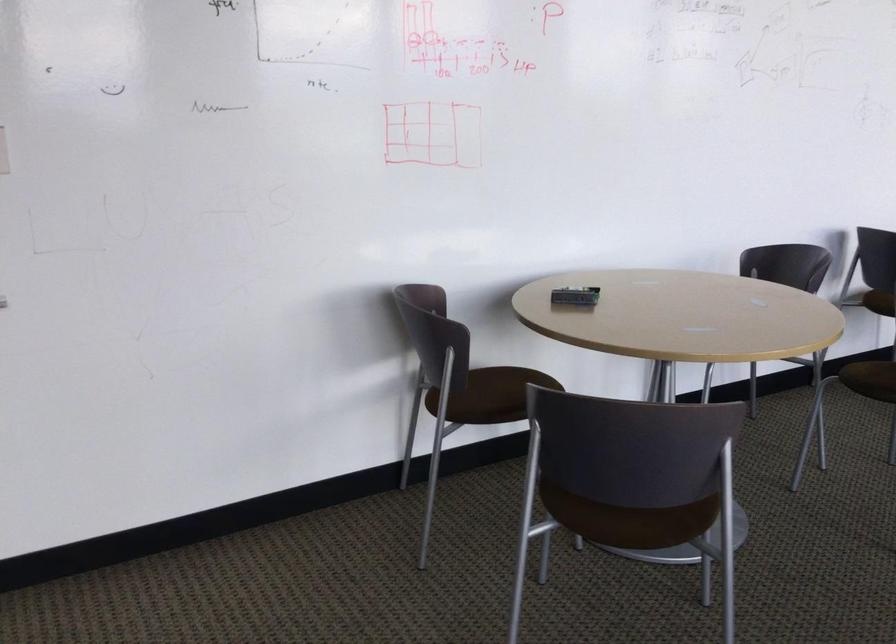
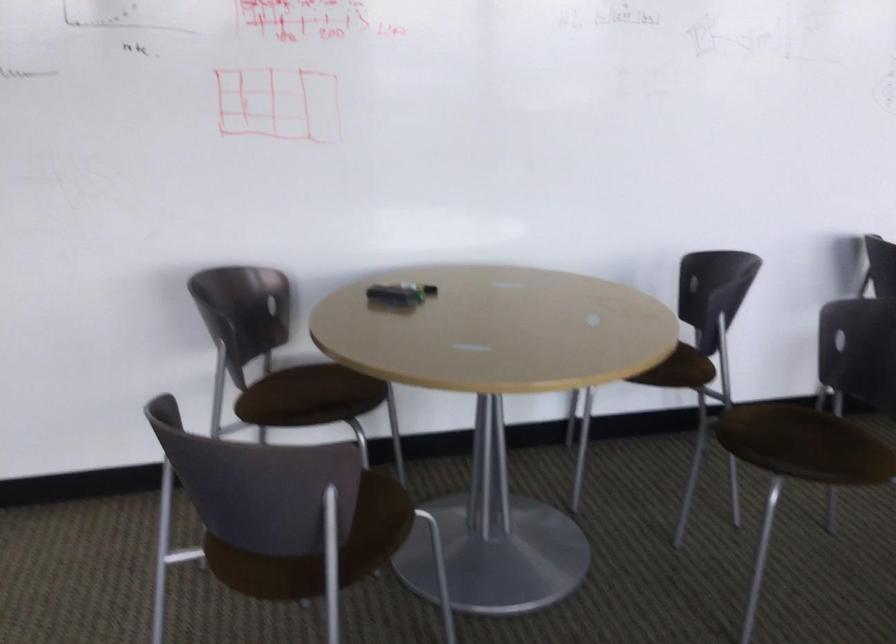
The point at (501, 384) is marked in the first image. Where is the corresponding point in the second image?

(314, 384)